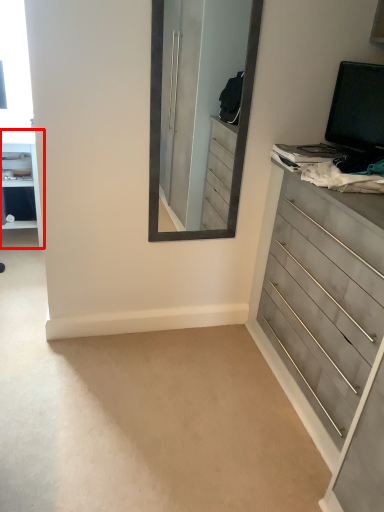
Question: From the image's perspective, considering the relative positions of vanity (annotated by the red box) and chest of drawers in the image provided, where is vanity (annotated by the red box) located with respect to the staircase?

Choices:
 (A) above
 (B) below

Answer: (A)